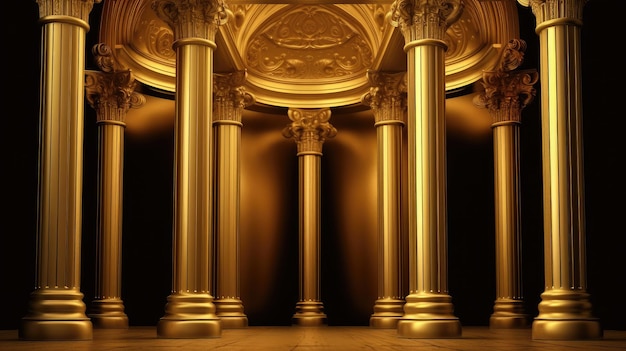
The width and height of the screenshot is (626, 351). Find the location of `floor`. floor is located at coordinates (349, 334).